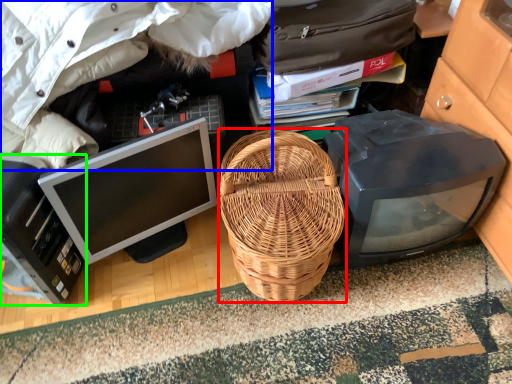
Question: Estimate the real-world distances between objects in this image. Which object is farther from picnic basket (highlighted by a red box), clothing (highlighted by a blue box) or computer (highlighted by a green box)?

Choices:
 (A) clothing
 (B) computer

Answer: (B)